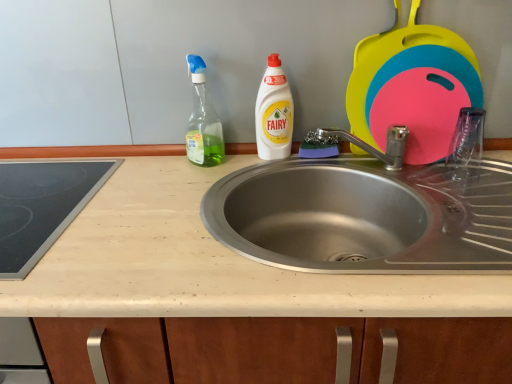
At what (x,y) coordinates should I click in order to perform the action: click on vacant space positioned to the left of white plastic bottle at center, acting as the 1th cleaning product starting from the right. Please return your answer as a coordinate pair (x, y). This screenshot has width=512, height=384. Looking at the image, I should click on (212, 169).